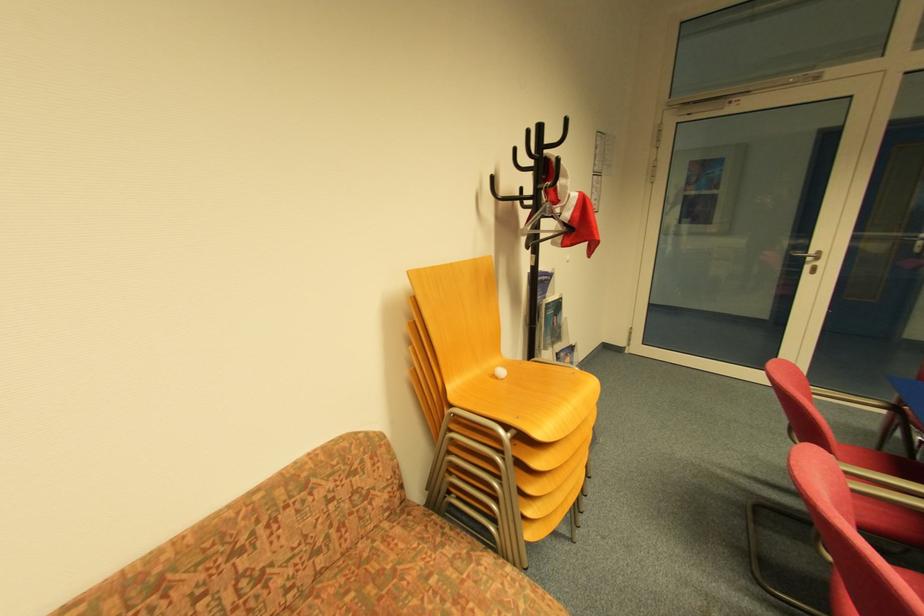
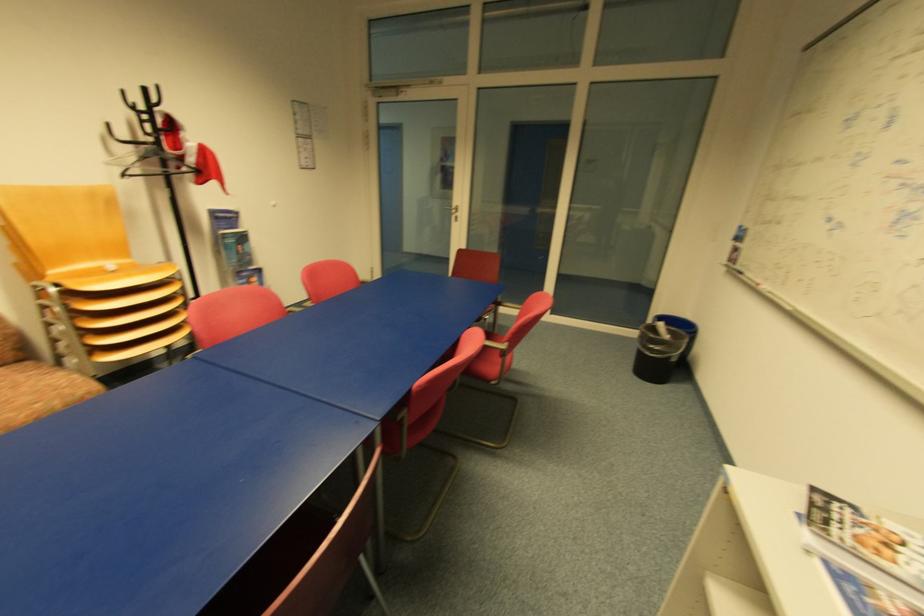
Which direction would the cameraman need to move to produce the second image?

The cameraman walked toward right, backward.